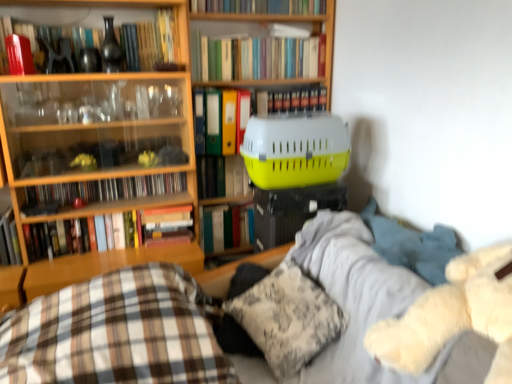
Question: From the image's perspective, would you say wooden bookcase at center is positioned over hardcover book at left, which ranks as the 11th book in top-to-bottom order?

Choices:
 (A) no
 (B) yes

Answer: (B)

Question: Is wooden bookcase at center aimed at hardcover book at left, which ranks as the 1th book in bottom-to-top order?

Choices:
 (A) yes
 (B) no

Answer: (B)

Question: From the image's perspective, does wooden bookcase at center appear lower than hardcover book at left, which ranks as the 11th book in top-to-bottom order?

Choices:
 (A) no
 (B) yes

Answer: (A)

Question: Are wooden bookcase at center and hardcover book at left, which ranks as the 1th book in bottom-to-top order, located far from each other?

Choices:
 (A) yes
 (B) no

Answer: (A)

Question: Can you confirm if wooden bookcase at center is positioned to the right of hardcover book at left, which ranks as the 11th book in top-to-bottom order?

Choices:
 (A) yes
 (B) no

Answer: (A)

Question: Is wooden bookcase at center outside hardcover book at left, which ranks as the 11th book in top-to-bottom order?

Choices:
 (A) yes
 (B) no

Answer: (A)

Question: From the image's perspective, would you say green matte book at center, positioned as the third book in bottom-to-top order, is positioned over fluffy white pillow at lower center, which is counted as the 2th pillow, starting from the right?

Choices:
 (A) yes
 (B) no

Answer: (A)

Question: From a real-world perspective, is green matte book at center, positioned as the ninth book in top-to-bottom order, positioned under fluffy white pillow at lower center, which is counted as the 2th pillow, starting from the right, based on gravity?

Choices:
 (A) no
 (B) yes

Answer: (A)

Question: Can you confirm if green matte book at center, positioned as the ninth book in top-to-bottom order, is wider than fluffy white pillow at lower center, which is counted as the 2th pillow, starting from the right?

Choices:
 (A) no
 (B) yes

Answer: (A)

Question: Considering the relative sizes of green matte book at center, positioned as the third book in bottom-to-top order, and fluffy white pillow at lower center, which is counted as the 2th pillow, starting from the right, in the image provided, is green matte book at center, positioned as the third book in bottom-to-top order, thinner than fluffy white pillow at lower center, which is counted as the 2th pillow, starting from the right,?

Choices:
 (A) no
 (B) yes

Answer: (B)

Question: Considering the relative sizes of green matte book at center, positioned as the ninth book in top-to-bottom order, and fluffy white pillow at lower center, which is counted as the 2th pillow, starting from the right, in the image provided, is green matte book at center, positioned as the ninth book in top-to-bottom order, smaller than fluffy white pillow at lower center, which is counted as the 2th pillow, starting from the right,?

Choices:
 (A) no
 (B) yes

Answer: (B)

Question: Can we say green matte book at center, positioned as the third book in bottom-to-top order, lies outside fluffy white pillow at lower center, the first pillow from the left?

Choices:
 (A) no
 (B) yes

Answer: (B)

Question: Is wooden bookshelf at left outside hardcover book at center, which is counted as the 5th book, starting from the top?

Choices:
 (A) yes
 (B) no

Answer: (A)